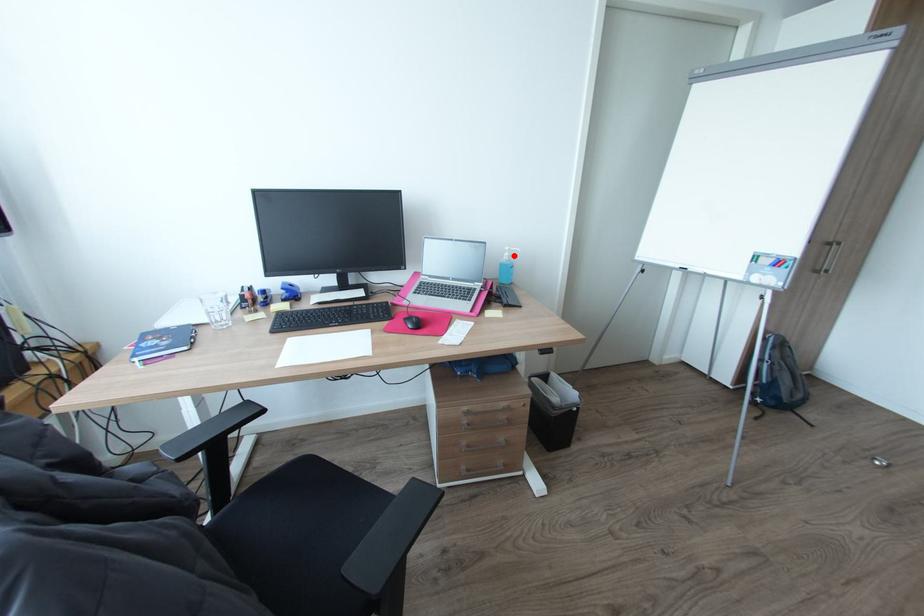
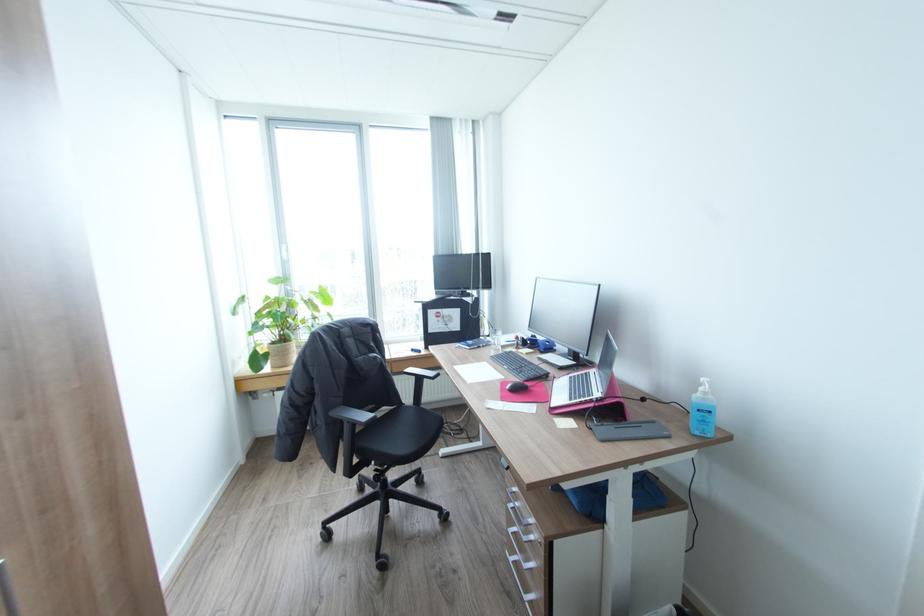
Where in the second image is the point corresponding to the highlighted location from the first image?

(710, 392)